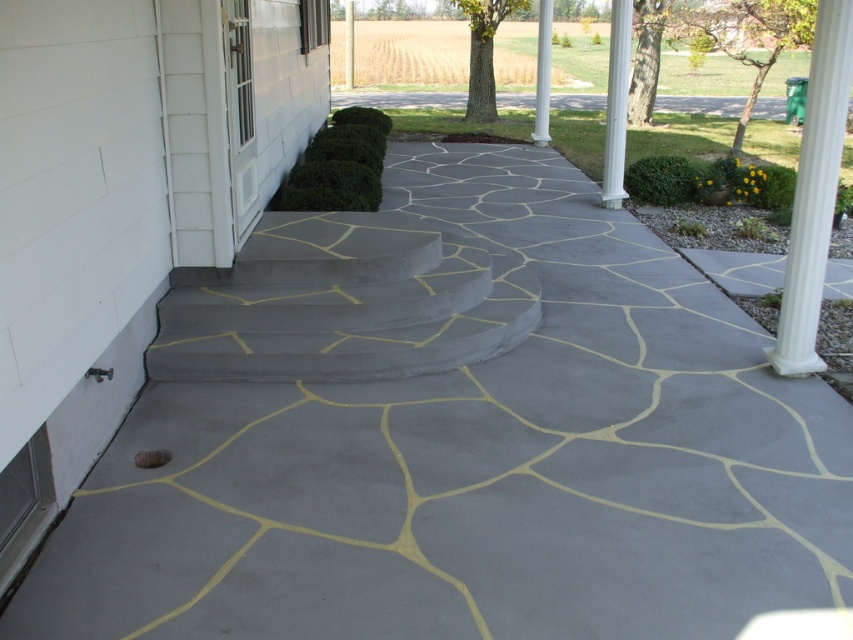
You are a delivery person trying to determine the best path to the front door. You notice the white smooth column at right and the gray concrete pillar at center. Which of these two objects is narrower and thus easier to navigate around?

The white smooth column at right is smaller than the gray concrete pillar at center, so it is narrower and easier to navigate around.

You are standing at the entrance of the house and want to go up the gray concrete stairs at center. Is the gray concrete pillar at center blocking your path to the stairs?

The gray concrete stairs at center is in front of the gray concrete pillar at center, so the pillar is behind the stairs and not blocking your path.